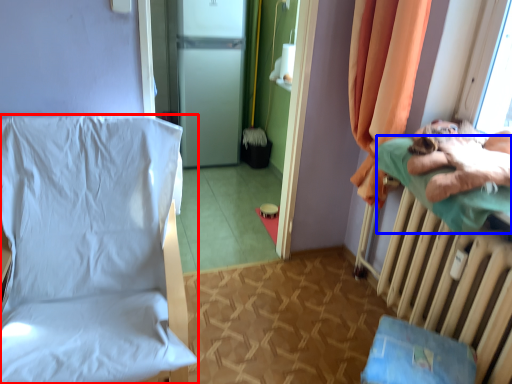
Question: Which point is closer to the camera, furniture (highlighted by a red box) or pillow (highlighted by a blue box)?

Choices:
 (A) furniture
 (B) pillow

Answer: (A)